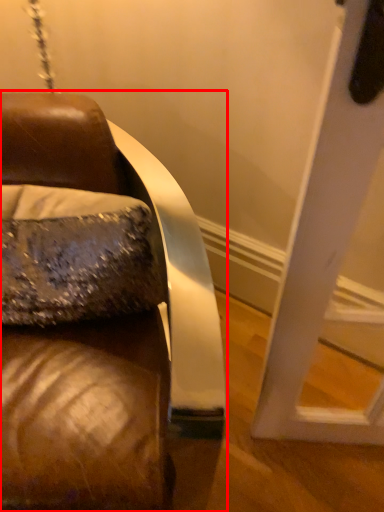
Question: In this image, where is furniture (annotated by the red box) located relative to throw pillow?

Choices:
 (A) left
 (B) right

Answer: (A)